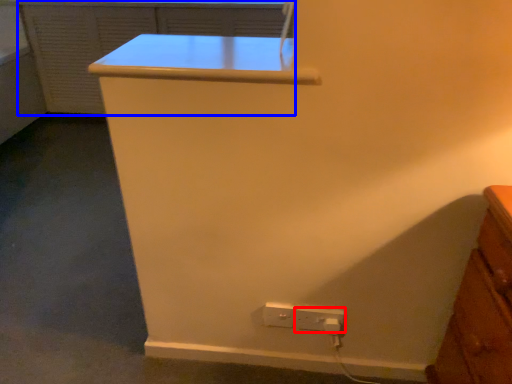
Question: Which object is further to the camera taking this photo, power plugs and sockets (highlighted by a red box) or file cabinet (highlighted by a blue box)?

Choices:
 (A) power plugs and sockets
 (B) file cabinet

Answer: (B)